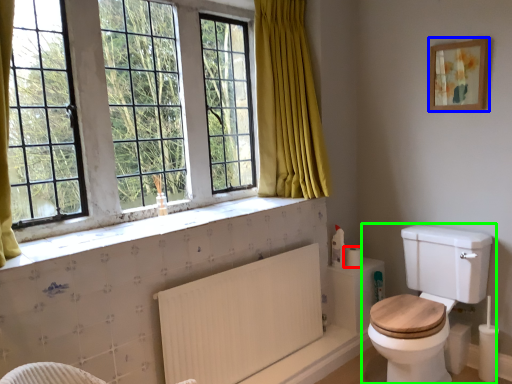
Question: Estimate the real-world distances between objects in this image. Which object is closer to toilet paper (highlighted by a red box), picture frame (highlighted by a blue box) or toilet (highlighted by a green box)?

Choices:
 (A) picture frame
 (B) toilet

Answer: (B)